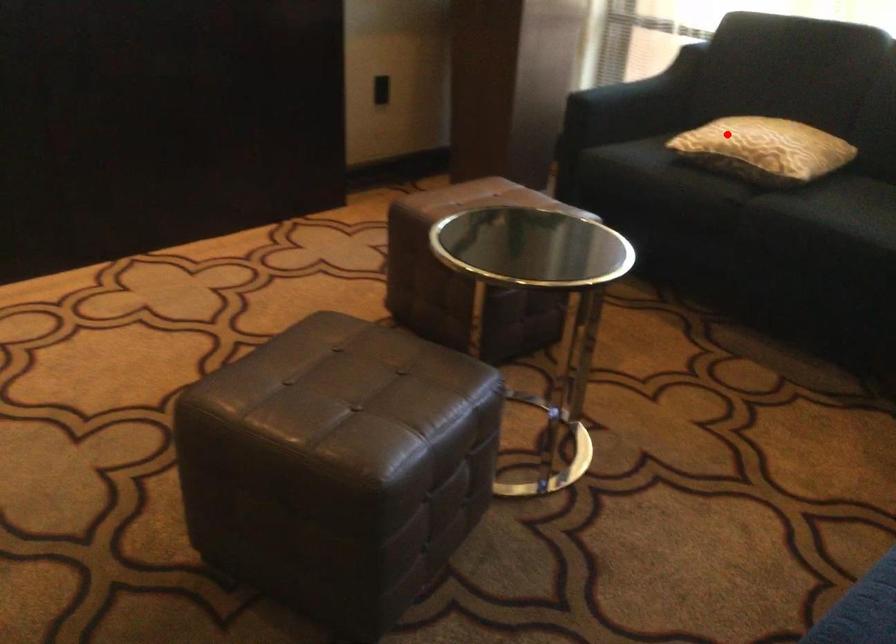
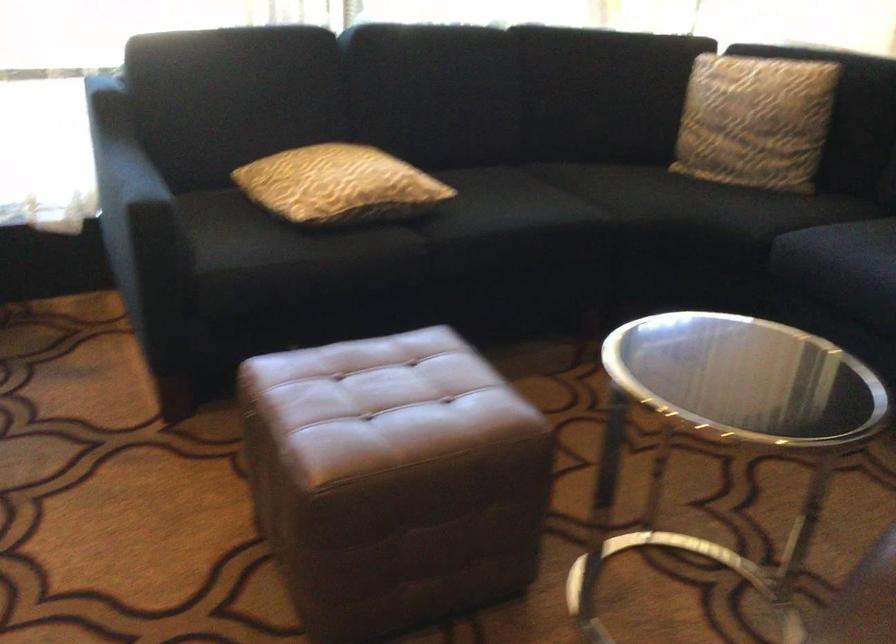
Question: I am providing you with two images of the same scene from different viewpoints. A red point is shown in image1. For the corresponding object point in image2, is it positioned nearer or farther from the camera?

Choices:
 (A) Nearer
 (B) Farther

Answer: (A)